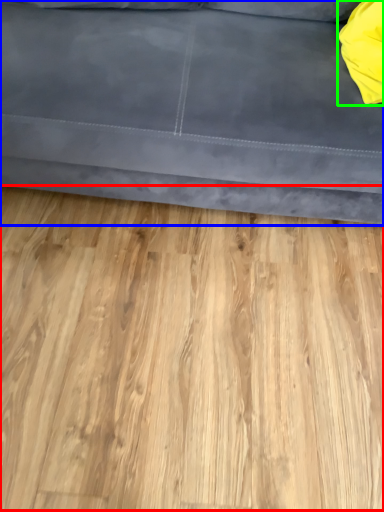
Question: Based on their relative distances, which object is farther from hardwood (highlighted by a red box)? Choose from studio couch (highlighted by a blue box) and pillow (highlighted by a green box).

Choices:
 (A) studio couch
 (B) pillow

Answer: (B)